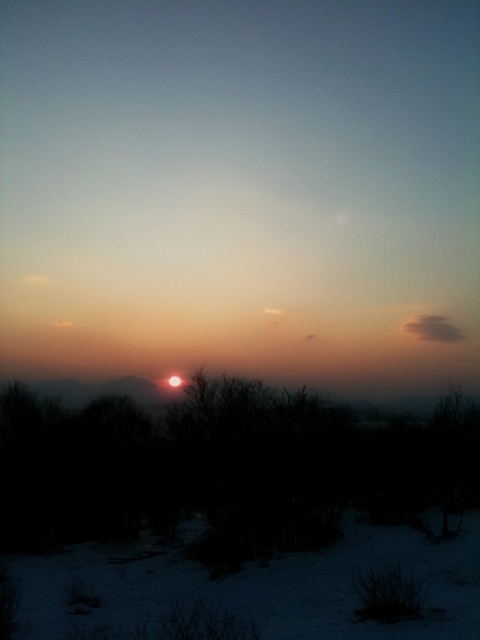
You are an observer standing in the winter sunset scene. You notice the silhouette leafless tree at center and the white powdery snow at lower center. Which object is positioned higher in the scene?

The silhouette leafless tree at center is positioned higher than the white powdery snow at lower center.

You are an observer standing in the winter sunset scene. You see the silhouette leafless tree at center and the white powdery snow at lower center. Which object is more to the left?

The silhouette leafless tree at center is more to the left side of the white powdery snow at lower center.

You are an observer standing at the edge of the snowy landscape in the winter sunset scene. You notice the silhouette leafless tree at center and the white powdery snow at lower center. Which object appears taller from your viewpoint?

The silhouette leafless tree at center is taller than the white powdery snow at lower center.